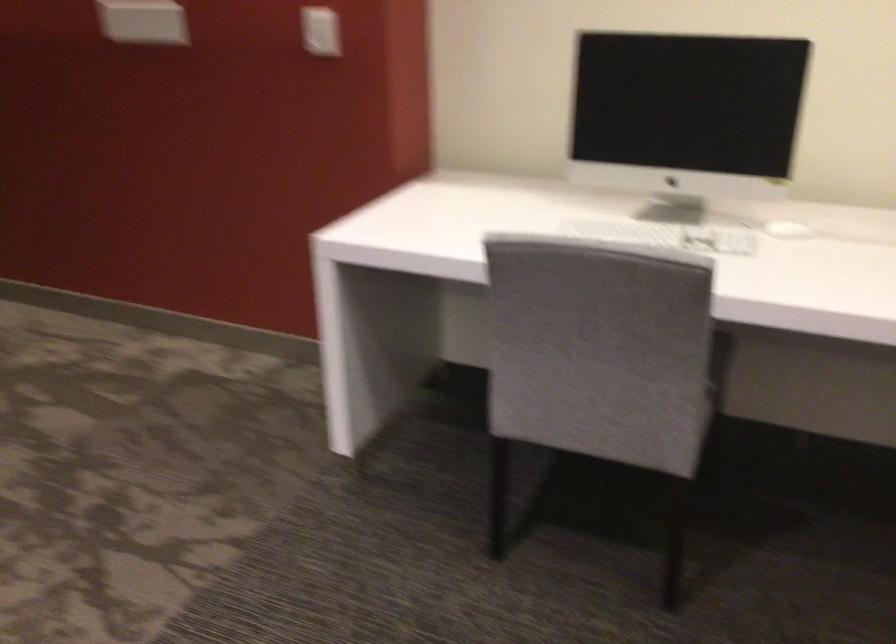
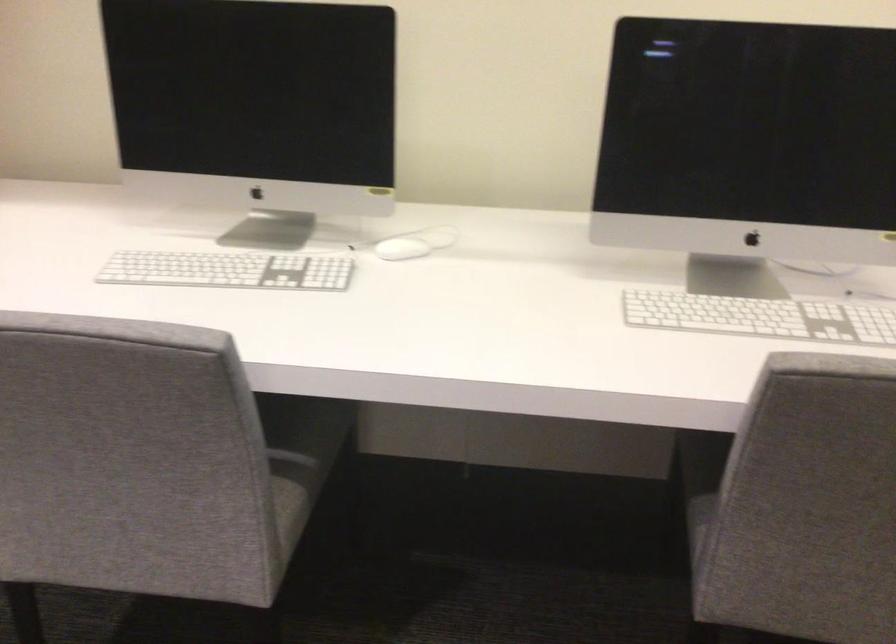
Find the pixel in the second image that matches (647,232) in the first image.

(228, 270)